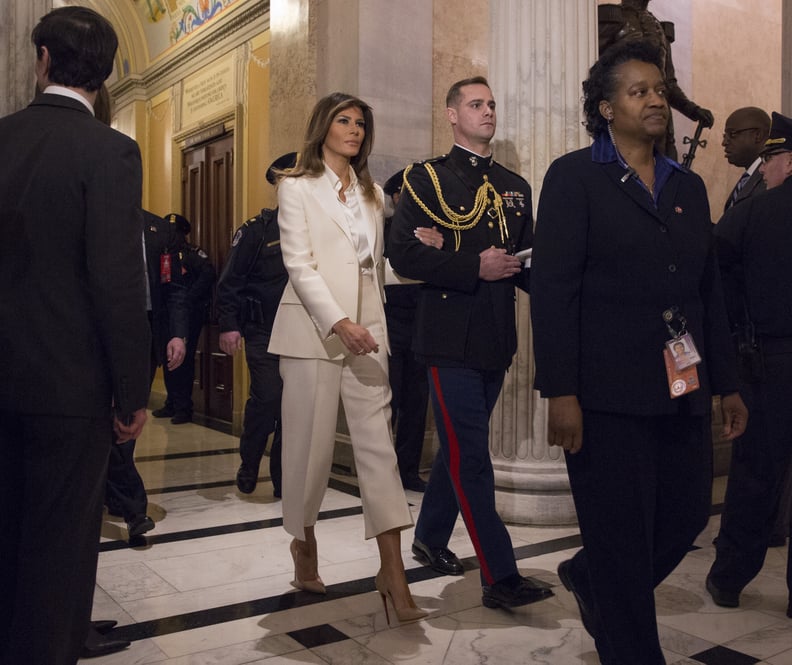
Where is `pillar`? pillar is located at coordinates (528, 66).